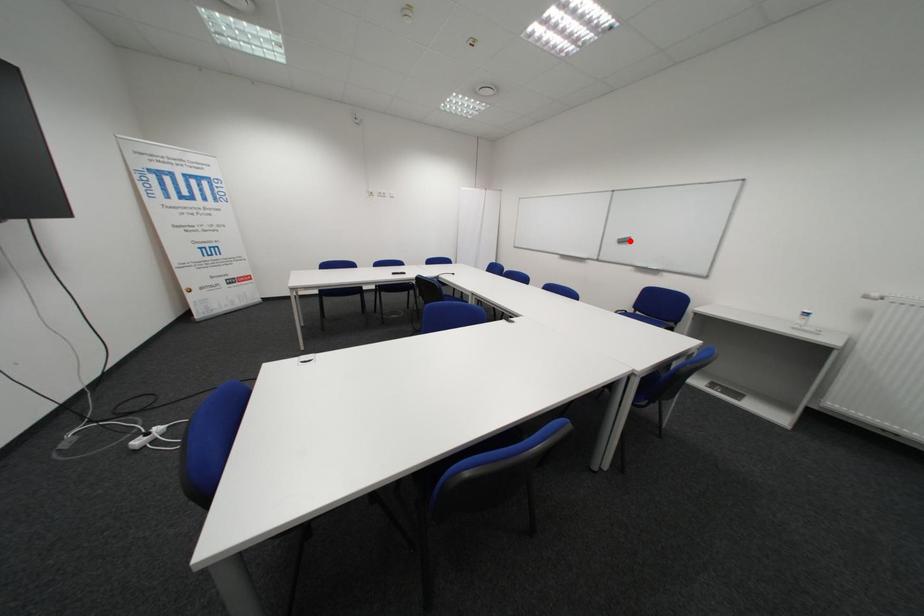
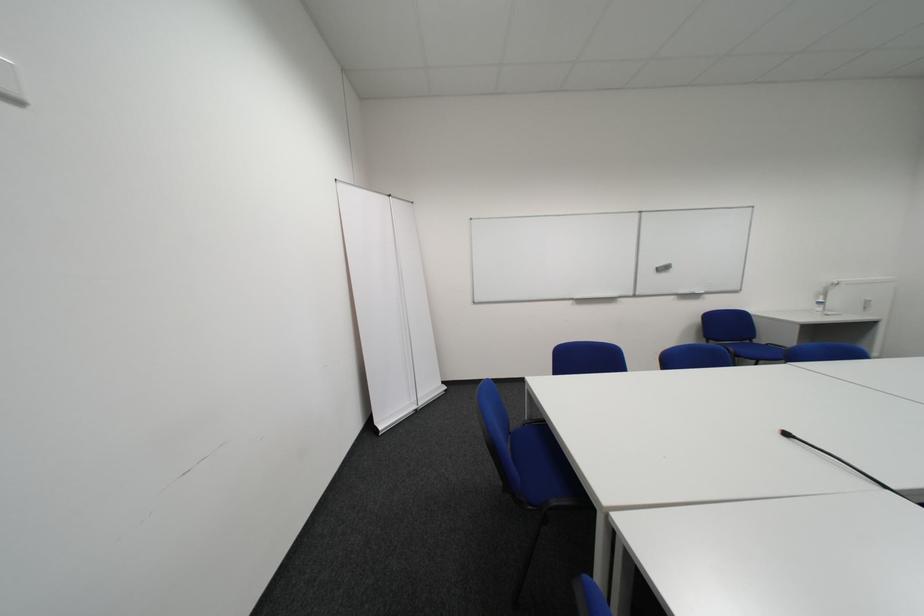
Find the pixel in the second image that matches the highlighted location in the first image.

(669, 270)